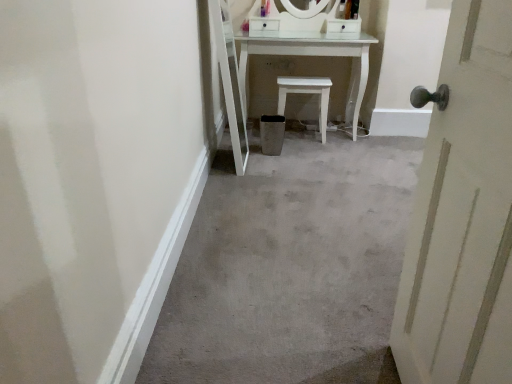
Describe the element at coordinates (463, 215) in the screenshot. I see `white painted wood door at right` at that location.

Identify the location of white painted wood door at right. (463, 215).

At what (x,y) coordinates should I click in order to perform the action: click on white matte stool at center. Please return your answer as a coordinate pair (x, y). This screenshot has height=384, width=512. Looking at the image, I should click on (306, 93).

This screenshot has height=384, width=512. What do you see at coordinates (306, 93) in the screenshot?
I see `white matte stool at center` at bounding box center [306, 93].

Measure the distance between point (325, 122) and camera.

The distance of point (325, 122) from camera is 3.15 meters.

The height and width of the screenshot is (384, 512). I want to click on white painted wood door at right, so click(463, 215).

Between white matte stool at center and white painted wood door at right, which one appears on the left side from the viewer's perspective?

white matte stool at center.

Does white matte stool at center come in front of white painted wood door at right?

No.

Is point (322, 95) closer or farther from the camera than point (482, 164)?

Point (322, 95) is farther from the camera than point (482, 164).

From the image's perspective, who appears lower, white matte stool at center or white painted wood door at right?

white painted wood door at right appears lower in the image.

From a real-world perspective, is white matte stool at center physically below white painted wood door at right?

Yes, from a real-world perspective, white matte stool at center is under white painted wood door at right.

Consider the image. Between white matte stool at center and white painted wood door at right, which one has smaller width?

white painted wood door at right.

Consider the image. Between white matte stool at center and white painted wood door at right, which one has more height?

With more height is white painted wood door at right.

Who is smaller, white matte stool at center or white painted wood door at right?

Smaller between the two is white matte stool at center.

Is white matte stool at center surrounding white painted wood door at right?

No, white painted wood door at right is located outside of white matte stool at center.

Is the surface of white matte stool at center in direct contact with white painted wood door at right?

white matte stool at center and white painted wood door at right are not in contact.

Is white matte stool at center oriented away from white painted wood door at right?

No, white matte stool at center is not facing away from white painted wood door at right.

How many degrees apart are the facing directions of white matte stool at center and white painted wood door at right?

90.9 degrees separate the facing orientations of white matte stool at center and white painted wood door at right.

How much distance is there between white matte stool at center and white painted wood door at right?

white matte stool at center is 7.32 feet from white painted wood door at right.

This screenshot has height=384, width=512. In order to click on door that appears in front of the white matte stool at center in this screenshot , I will do tap(463, 215).

Considering the relative positions of white painted wood door at right and white matte stool at center in the image provided, is white painted wood door at right to the right of white matte stool at center from the viewer's perspective?

Yes, white painted wood door at right is to the right of white matte stool at center.

Does white painted wood door at right lie behind white matte stool at center?

No, the depth of white painted wood door at right is less than that of white matte stool at center.

Between point (460, 121) and point (324, 103), which one is positioned in front?

The point (460, 121) is closer to the camera.

From the image's perspective, which one is positioned higher, white painted wood door at right or white matte stool at center?

white matte stool at center is shown above in the image.

From a real-world perspective, relative to white matte stool at center, is white painted wood door at right vertically above or below?

white painted wood door at right is situated higher than white matte stool at center in the real world.

In terms of width, does white painted wood door at right look wider or thinner when compared to white matte stool at center?

Considering their sizes, white painted wood door at right looks slimmer than white matte stool at center.

Between white painted wood door at right and white matte stool at center, which one has more height?

white painted wood door at right.

Is white painted wood door at right smaller than white matte stool at center?

No, white painted wood door at right is not smaller than white matte stool at center.

Would you say white matte stool at center is part of white painted wood door at right's contents?

That's incorrect, white matte stool at center is not inside white painted wood door at right.

Is white painted wood door at right far away from white matte stool at center?

Yes, white painted wood door at right and white matte stool at center are located far from each other.

Could you tell me if white painted wood door at right is facing white matte stool at center?

No, white painted wood door at right is not facing towards white matte stool at center.

How distant is white painted wood door at right from white matte stool at center?

The distance of white painted wood door at right from white matte stool at center is 2.23 meters.

Find the location of `door located above the white matte stool at center (from a real-world perspective)`. door located above the white matte stool at center (from a real-world perspective) is located at coordinates (463, 215).

Image resolution: width=512 pixels, height=384 pixels. I want to click on door lying in front of the white matte stool at center, so click(x=463, y=215).

This screenshot has width=512, height=384. Identify the location of door below the white matte stool at center (from the image's perspective). (463, 215).